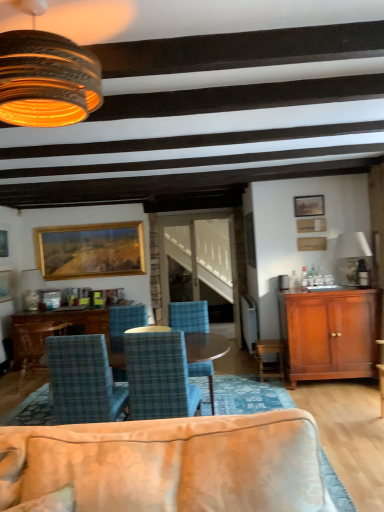
Question: From a real-world perspective, relative to wooden table at center, is rustic wood lampshade at upper left, the first lamp positioned from the left, vertically above or below?

Choices:
 (A) below
 (B) above

Answer: (B)

Question: In the image, is rustic wood lampshade at upper left, the 2th lamp from the back, positioned in front of or behind wooden table at center?

Choices:
 (A) front
 (B) behind

Answer: (A)

Question: Estimate the real-world distances between objects in this image. Which object is farther from the wooden table at center?

Choices:
 (A) gold wooden picture frame at upper left, which is the 2th picture frame from left to right
 (B) gold-framed painting at left, the second picture frame from the back
 (C) blue plaid chair at center, arranged as the fourth chair when viewed from the back
 (D) transparent glass door at center
 (E) white fabric lampshade at upper right, which ranks as the second lamp in top-to-bottom order

Answer: (E)

Question: Considering the real-world distances, which object is farthest from the wooden framed painting at upper center, placed as the fourth picture frame when sorted from back to front?

Choices:
 (A) mahogany wood cabinet at right
 (B) wooden table at center
 (C) gold-framed painting at left, which is the first picture frame in left-to-right order
 (D) transparent glass door at center
 (E) blue plaid chair at center, the fourth chair viewed from the front

Answer: (C)